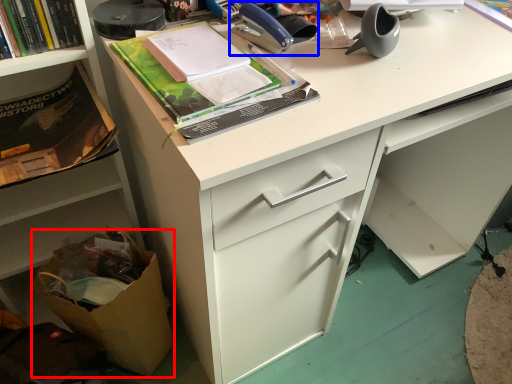
Question: Which of the following is the farthest to the observer, cardboard box (highlighted by a red box) or office supplies (highlighted by a blue box)?

Choices:
 (A) cardboard box
 (B) office supplies

Answer: (A)